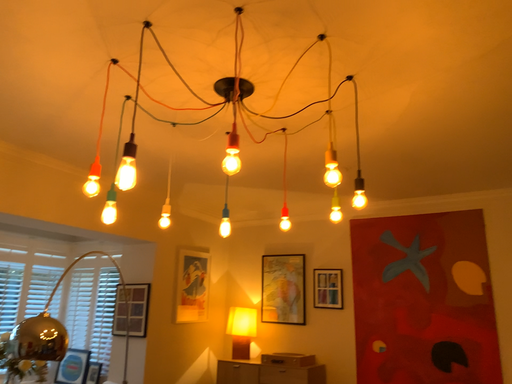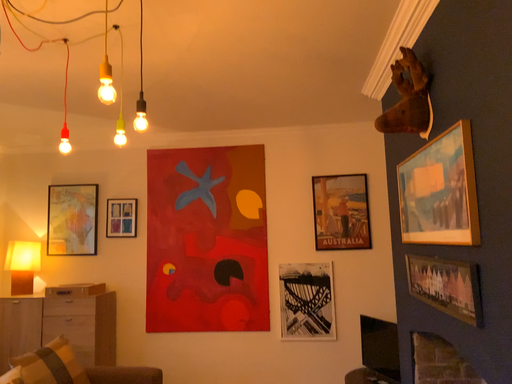
Question: How did the camera likely rotate when shooting the video?

Choices:
 (A) rotated upward
 (B) rotated downward

Answer: (B)